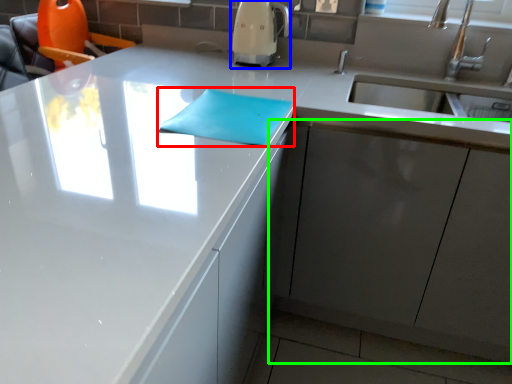
Question: Based on their relative distances, which object is nearer to notepad (highlighted by a red box)? Choose from coffee machine (highlighted by a blue box) and cabinetry (highlighted by a green box).

Choices:
 (A) coffee machine
 (B) cabinetry

Answer: (B)